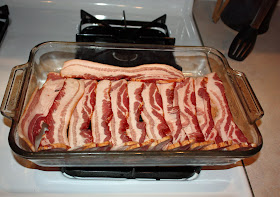
Image resolution: width=280 pixels, height=197 pixels. I want to click on white stove, so click(x=24, y=182).